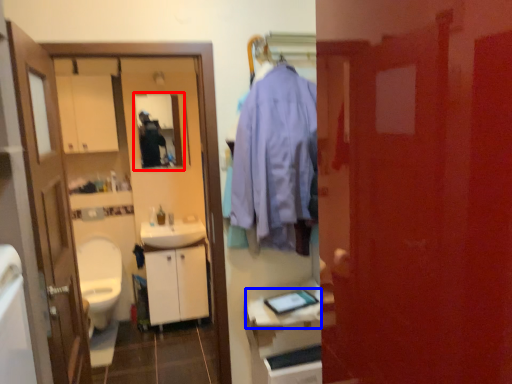
Question: Which object is further to the camera taking this photo, mirror (highlighted by a red box) or counter top (highlighted by a blue box)?

Choices:
 (A) mirror
 (B) counter top

Answer: (A)